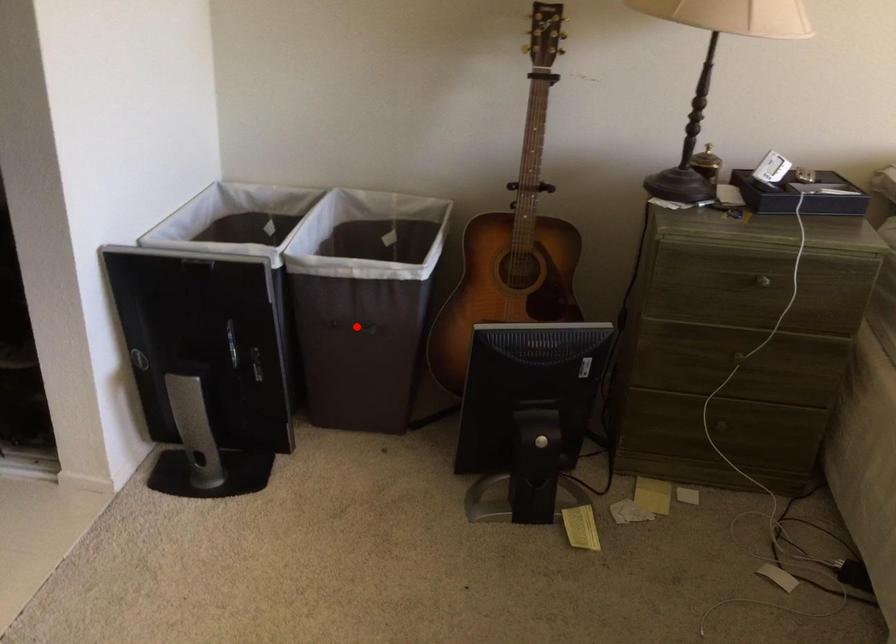
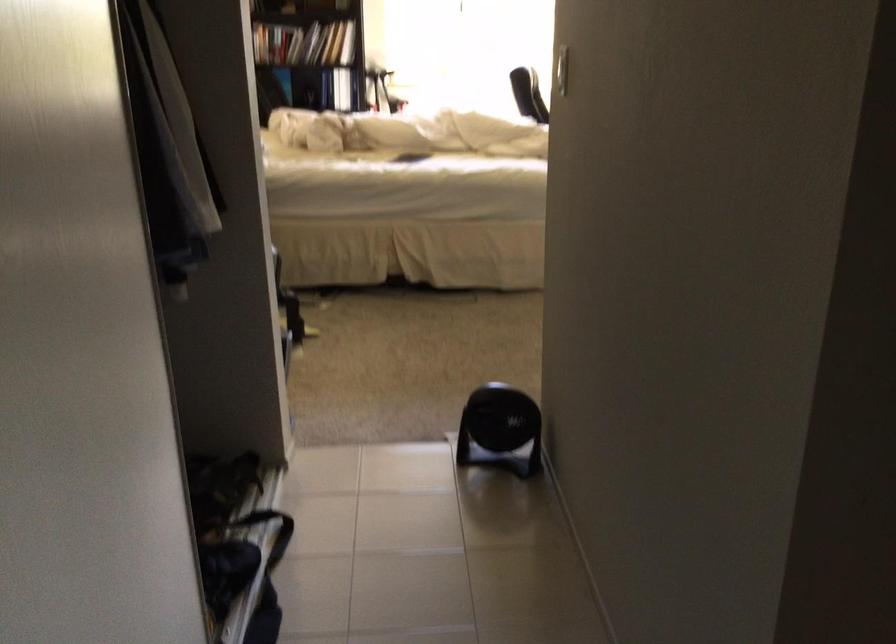
Question: I am providing you with two images of the same scene from different viewpoints. A red point is marked on the first image. Can you still see the location of the red point in image 2?

Choices:
 (A) Yes
 (B) No

Answer: (B)